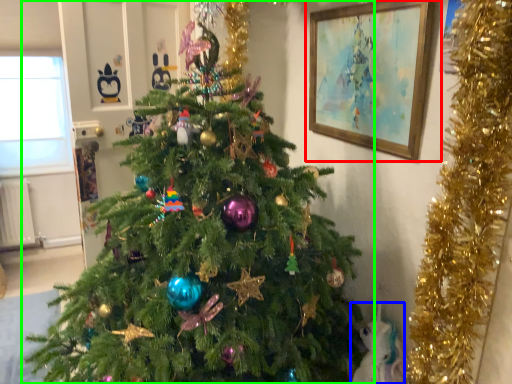
Question: Which object is the closest to the picture frame (highlighted by a red box)? Choose among these: animal (highlighted by a blue box) or christmas tree (highlighted by a green box).

Choices:
 (A) animal
 (B) christmas tree

Answer: (B)